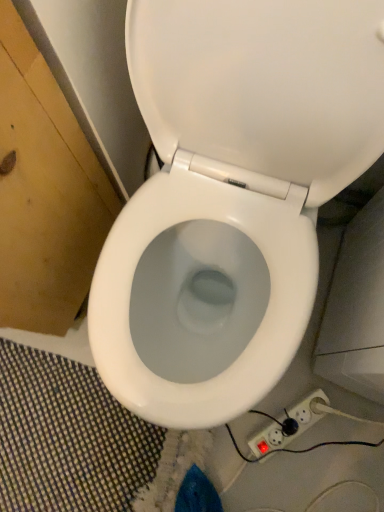
Locate an element on the screen. The image size is (384, 512). white plastic power strip at lower right is located at coordinates coord(288,425).

Measure the distance between white plastic power strip at lower right and camera.

white plastic power strip at lower right is 3.30 feet from camera.

The height and width of the screenshot is (512, 384). What do you see at coordinates (288, 425) in the screenshot? I see `white plastic power strip at lower right` at bounding box center [288, 425].

What do you see at coordinates (231, 196) in the screenshot? I see `white glossy toilet at center` at bounding box center [231, 196].

You are a GUI agent. You are given a task and a screenshot of the screen. Output one action in this format:
    pyautogui.click(x=<x>, y=<y>)
    Task: Click on the white glossy toilet at center
    This screenshot has height=512, width=384.
    Given the screenshot: What is the action you would take?
    pyautogui.click(x=231, y=196)

At what (x,y) coordinates should I click in order to perform the action: click on white plastic power strip at lower right. Please return your answer as a coordinate pair (x, y). The image size is (384, 512). Looking at the image, I should click on (288, 425).

Which object is positioned more to the right, white plastic power strip at lower right or white glossy toilet at center?

white plastic power strip at lower right is more to the right.

In the image, is white plastic power strip at lower right positioned in front of or behind white glossy toilet at center?

Visually, white plastic power strip at lower right is located behind white glossy toilet at center.

Which is behind, point (265, 450) or point (314, 239)?

The point (265, 450) is farther.

From the image's perspective, which object appears higher, white plastic power strip at lower right or white glossy toilet at center?

white glossy toilet at center, from the image's perspective.

From the picture: From a real-world perspective, is white plastic power strip at lower right located beneath white glossy toilet at center?

Correct, in the physical world, white plastic power strip at lower right is lower than white glossy toilet at center.

Looking at their sizes, would you say white plastic power strip at lower right is wider or thinner than white glossy toilet at center?

In the image, white plastic power strip at lower right appears to be more narrow than white glossy toilet at center.

Does white plastic power strip at lower right have a lesser height compared to white glossy toilet at center?

Indeed, white plastic power strip at lower right has a lesser height compared to white glossy toilet at center.

Between white plastic power strip at lower right and white glossy toilet at center, which one has larger size?

With larger size is white glossy toilet at center.

Is white glossy toilet at center located within white plastic power strip at lower right?

No, white glossy toilet at center is not surrounded by white plastic power strip at lower right.

Are white plastic power strip at lower right and white glossy toilet at center making contact?

No, white plastic power strip at lower right is not in contact with white glossy toilet at center.

Does white plastic power strip at lower right turn towards white glossy toilet at center?

No, white plastic power strip at lower right is not turned towards white glossy toilet at center.

How different are the orientations of white plastic power strip at lower right and white glossy toilet at center in degrees?

They differ by 31.6 degrees in their facing directions.

How distant is white plastic power strip at lower right from white glossy toilet at center?

They are 19.62 inches apart.

The image size is (384, 512). Find the location of `electric outlet below the white glossy toilet at center (from the image's perspective)`. electric outlet below the white glossy toilet at center (from the image's perspective) is located at coordinates (288, 425).

Visually, is white glossy toilet at center positioned to the left or to the right of white plastic power strip at lower right?

white glossy toilet at center is positioned on white plastic power strip at lower right's left side.

Considering the positions of objects white glossy toilet at center and white plastic power strip at lower right in the image provided, who is in front, white glossy toilet at center or white plastic power strip at lower right?

white glossy toilet at center is more forward.

Considering the positions of points (242, 367) and (262, 449), is point (242, 367) closer to camera compared to point (262, 449)?

That is True.

From the image's perspective, is white glossy toilet at center located above or below white plastic power strip at lower right?

Clearly, from the image's perspective, white glossy toilet at center is above white plastic power strip at lower right.

From a real-world perspective, who is located lower, white glossy toilet at center or white plastic power strip at lower right?

white plastic power strip at lower right.

Considering the sizes of objects white glossy toilet at center and white plastic power strip at lower right in the image provided, who is thinner, white glossy toilet at center or white plastic power strip at lower right?

Thinner between the two is white plastic power strip at lower right.

Is white glossy toilet at center shorter than white plastic power strip at lower right?

No.

Is white glossy toilet at center smaller than white plastic power strip at lower right?

Incorrect, white glossy toilet at center is not smaller in size than white plastic power strip at lower right.

Can we say white glossy toilet at center lies outside white plastic power strip at lower right?

That's correct, white glossy toilet at center is outside of white plastic power strip at lower right.

Is white glossy toilet at center far away from white plastic power strip at lower right?

No, white glossy toilet at center is not far away from white plastic power strip at lower right.

In the scene shown: Is white glossy toilet at center facing towards white plastic power strip at lower right?

No, white glossy toilet at center is not aimed at white plastic power strip at lower right.

How many degrees apart are the facing directions of white glossy toilet at center and white plastic power strip at lower right?

They differ by 31.6 degrees in their facing directions.

This screenshot has height=512, width=384. In the image, there is a white glossy toilet at center. Identify the location of electric outlet below it (from the image's perspective). (288, 425).

Locate an element on the screen. The width and height of the screenshot is (384, 512). electric outlet that appears below the white glossy toilet at center (from the image's perspective) is located at coordinates (288, 425).

I want to click on toilet located in front of the white plastic power strip at lower right, so click(231, 196).